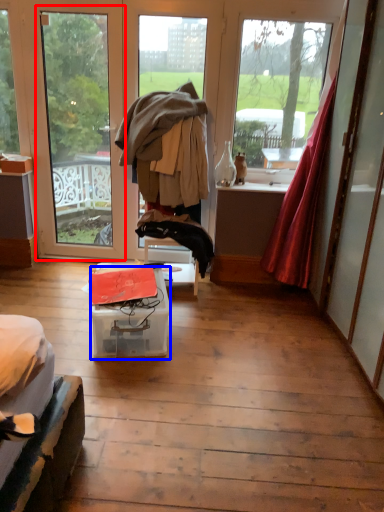
Question: Among these objects, which one is farthest to the camera, window (highlighted by a red box) or box (highlighted by a blue box)?

Choices:
 (A) window
 (B) box

Answer: (A)